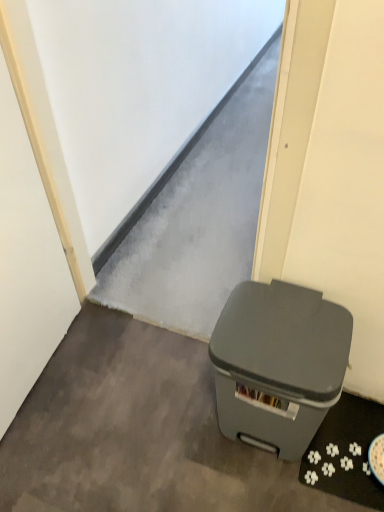
Question: Could you tell me if matte gray plastic trash can at lower right is turned towards gray matte trash can at lower right?

Choices:
 (A) no
 (B) yes

Answer: (A)

Question: Considering the relative sizes of matte gray plastic trash can at lower right and gray matte trash can at lower right in the image provided, is matte gray plastic trash can at lower right bigger than gray matte trash can at lower right?

Choices:
 (A) no
 (B) yes

Answer: (B)

Question: Are matte gray plastic trash can at lower right and gray matte trash can at lower right beside each other?

Choices:
 (A) no
 (B) yes

Answer: (A)

Question: From the image's perspective, does matte gray plastic trash can at lower right appear higher than gray matte trash can at lower right?

Choices:
 (A) no
 (B) yes

Answer: (B)

Question: Does matte gray plastic trash can at lower right have a lesser height compared to gray matte trash can at lower right?

Choices:
 (A) yes
 (B) no

Answer: (B)

Question: Is matte gray plastic trash can at lower right wider than gray matte trash can at lower right?

Choices:
 (A) yes
 (B) no

Answer: (B)

Question: From the image's perspective, is gray matte trash can at lower right on matte gray plastic trash can at lower right?

Choices:
 (A) no
 (B) yes

Answer: (A)

Question: From a real-world perspective, is gray matte trash can at lower right located higher than matte gray plastic trash can at lower right?

Choices:
 (A) yes
 (B) no

Answer: (B)

Question: Is gray matte trash can at lower right further to camera compared to matte gray plastic trash can at lower right?

Choices:
 (A) no
 (B) yes

Answer: (B)

Question: Is gray matte trash can at lower right positioned before matte gray plastic trash can at lower right?

Choices:
 (A) no
 (B) yes

Answer: (A)

Question: Would you say gray matte trash can at lower right is a long distance from matte gray plastic trash can at lower right?

Choices:
 (A) no
 (B) yes

Answer: (A)

Question: Is gray matte trash can at lower right aimed at matte gray plastic trash can at lower right?

Choices:
 (A) yes
 (B) no

Answer: (B)

Question: Is matte gray plastic trash can at lower right in front of or behind gray matte trash can at lower right in the image?

Choices:
 (A) front
 (B) behind

Answer: (A)